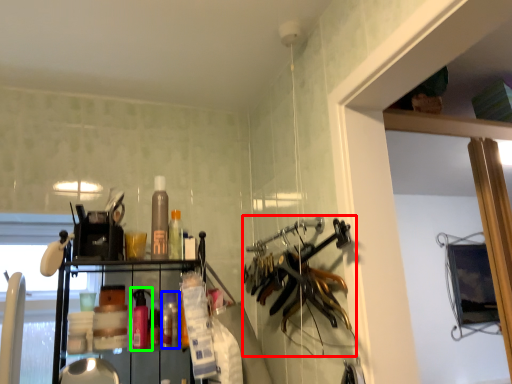
Question: Which object is positioned closest to hanger (highlighted by a red box)? Select from bottle (highlighted by a blue box) and bottle (highlighted by a green box).

Choices:
 (A) bottle
 (B) bottle

Answer: (A)